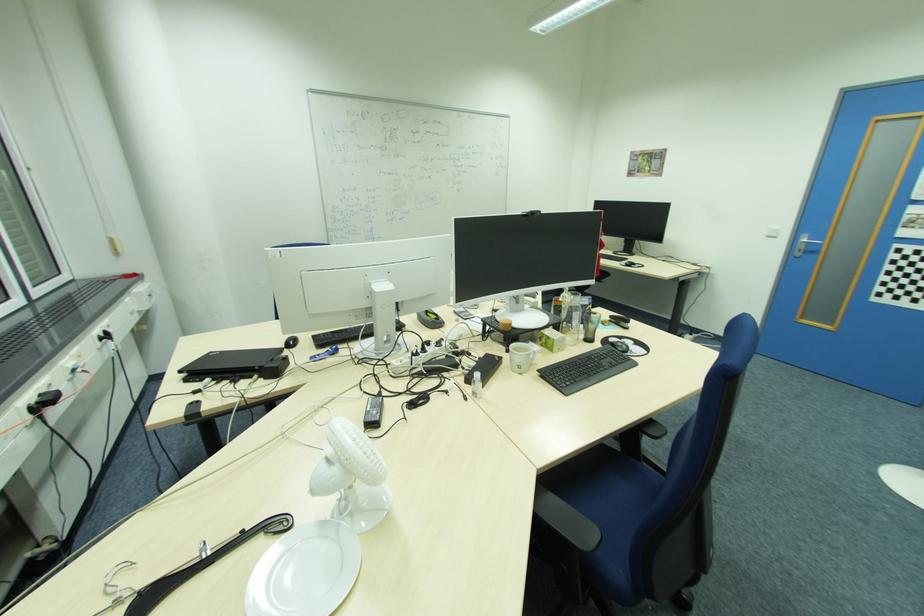
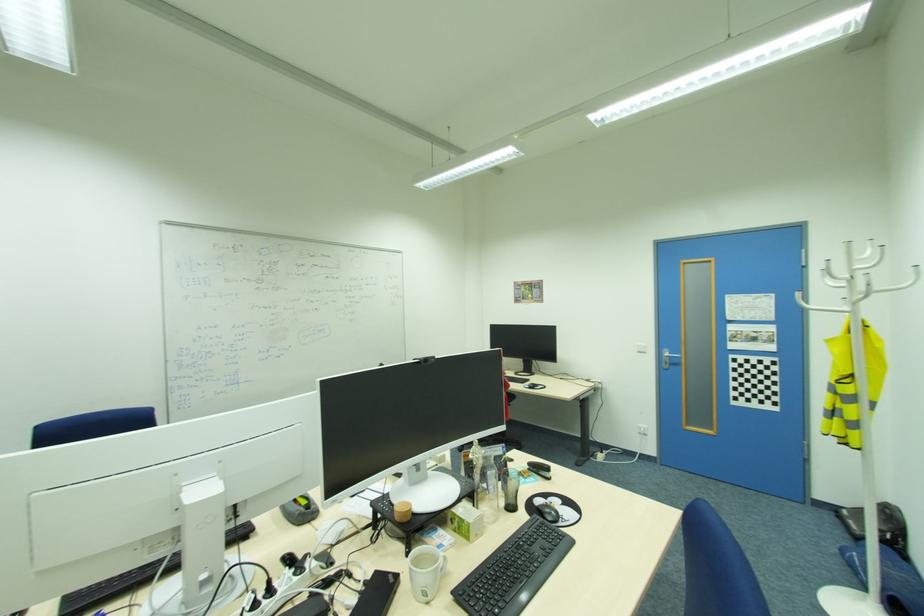
The images are taken continuously from a first-person perspective. In which direction is your viewpoint rotating?

The rotation direction of the camera is right-up.